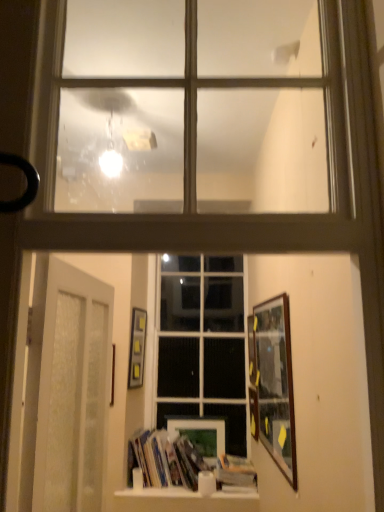
Question: Considering the relative positions of matte black picture frame at center-left, the 5th picture frame from the right, and hardcover book at center in the image provided, is matte black picture frame at center-left, the 5th picture frame from the right, to the right of hardcover book at center from the viewer's perspective?

Choices:
 (A) yes
 (B) no

Answer: (B)

Question: From a real-world perspective, is matte black picture frame at center-left, the first picture frame positioned from the left, over hardcover book at center?

Choices:
 (A) no
 (B) yes

Answer: (B)

Question: Can hardcover book at center be found inside matte black picture frame at center-left, the first picture frame positioned from the left?

Choices:
 (A) no
 (B) yes

Answer: (A)

Question: Can you confirm if matte black picture frame at center-left, the first picture frame positioned from the left, is wider than hardcover book at center?

Choices:
 (A) yes
 (B) no

Answer: (B)

Question: Considering the relative sizes of matte black picture frame at center-left, the first picture frame positioned from the left, and hardcover book at center in the image provided, is matte black picture frame at center-left, the first picture frame positioned from the left, smaller than hardcover book at center?

Choices:
 (A) yes
 (B) no

Answer: (A)

Question: Is hardcover book at center at the back of matte black picture frame at center-left, the 5th picture frame from the right?

Choices:
 (A) no
 (B) yes

Answer: (A)

Question: Is wooden picture frame at center, marked as the 4th picture frame in a right-to-left arrangement, oriented towards hardcover book at center?

Choices:
 (A) yes
 (B) no

Answer: (A)

Question: Is the depth of wooden picture frame at center, the 2th picture frame in the left-to-right sequence, greater than that of hardcover book at center?

Choices:
 (A) no
 (B) yes

Answer: (B)

Question: Can you confirm if wooden picture frame at center, the 2th picture frame in the left-to-right sequence, is wider than hardcover book at center?

Choices:
 (A) yes
 (B) no

Answer: (B)

Question: Does wooden picture frame at center, the 2th picture frame in the left-to-right sequence, have a lesser height compared to hardcover book at center?

Choices:
 (A) no
 (B) yes

Answer: (A)

Question: Considering the relative positions of wooden picture frame at center, the 2th picture frame in the left-to-right sequence, and hardcover book at center in the image provided, is wooden picture frame at center, the 2th picture frame in the left-to-right sequence, to the right of hardcover book at center from the viewer's perspective?

Choices:
 (A) no
 (B) yes

Answer: (A)

Question: Considering the relative sizes of wooden picture frame at center, the 2th picture frame in the left-to-right sequence, and hardcover book at center in the image provided, is wooden picture frame at center, the 2th picture frame in the left-to-right sequence, bigger than hardcover book at center?

Choices:
 (A) yes
 (B) no

Answer: (B)

Question: From a real-world perspective, is black rubber door handle at left positioned over white frosted glass door at lower left based on gravity?

Choices:
 (A) yes
 (B) no

Answer: (A)